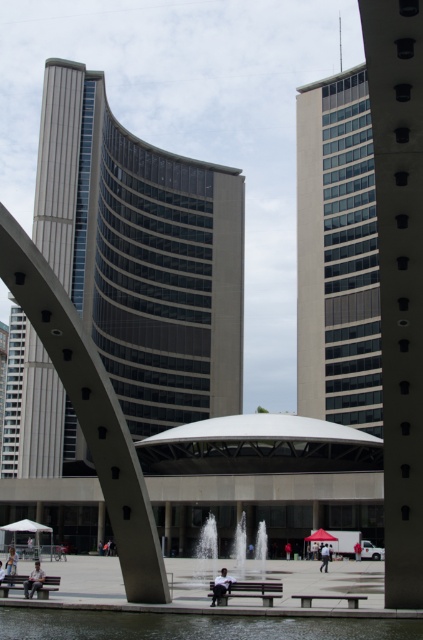
Is glassy steel tower at center thinner than matte glass tower at upper right?

No.

How much distance is there between glassy steel tower at center and matte glass tower at upper right?

glassy steel tower at center is 84.47 feet from matte glass tower at upper right.

Is point (96, 269) more distant than point (329, 371)?

No, it is not.

Locate an element on the screen. The image size is (423, 640). glassy steel tower at center is located at coordinates (142, 253).

Locate an element on the screen. clear glass water at center is located at coordinates pyautogui.click(x=206, y=547).

Between point (241, 550) and point (233, 579), which one is positioned in front?

Point (233, 579) is more forward.

Is point (214, 572) positioned in front of point (230, 580)?

That is False.

The width and height of the screenshot is (423, 640). I want to click on clear glass water at center, so click(x=206, y=547).

The width and height of the screenshot is (423, 640). In order to click on matte glass tower at upper right in this screenshot , I will do `click(337, 253)`.

Is matte glass tower at upper right to the right of clear water at lower center from the viewer's perspective?

Indeed, matte glass tower at upper right is positioned on the right side of clear water at lower center.

Image resolution: width=423 pixels, height=640 pixels. What are the coordinates of `matte glass tower at upper right` in the screenshot? It's located at (337, 253).

Where is `matte glass tower at upper right`? The width and height of the screenshot is (423, 640). matte glass tower at upper right is located at coordinates (337, 253).